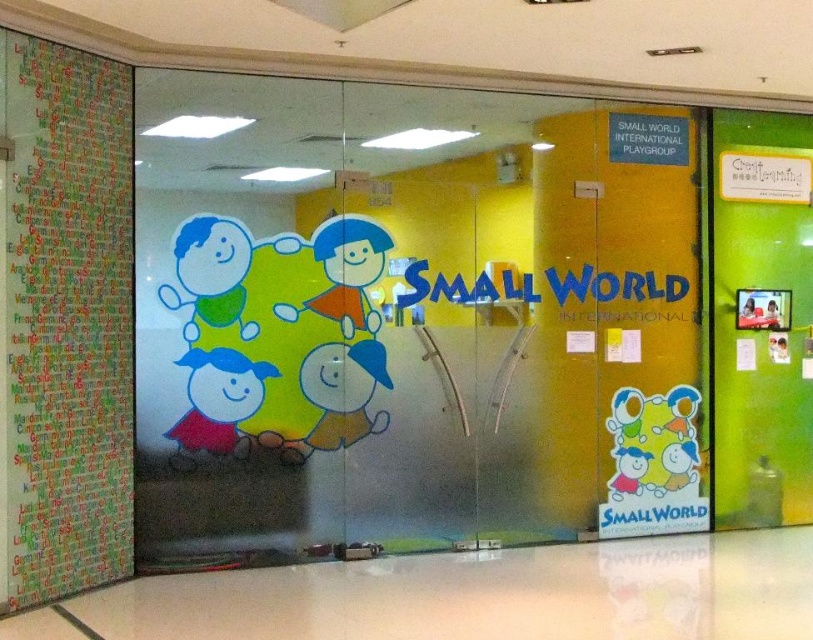
Question: Which is nearer to the matte red dress at lower left?

Choices:
 (A) transparent glass door at center
 (B) multicolored paper at left

Answer: (B)

Question: Which point is closer to the camera?

Choices:
 (A) (24, 198)
 (B) (218, 378)
 (C) (781, 481)
 (D) (342, 330)

Answer: (A)

Question: Does green matte door at right appear over matte red dress at lower left?

Choices:
 (A) no
 (B) yes

Answer: (B)

Question: Can you confirm if green matte door at right is thinner than matte red dress at lower left?

Choices:
 (A) yes
 (B) no

Answer: (B)

Question: In this image, where is transparent glass door at center located relative to multicolored paper at left?

Choices:
 (A) left
 (B) right

Answer: (B)

Question: Which of the following is the closest to the observer?

Choices:
 (A) (241, 396)
 (B) (767, 266)
 (C) (167, 339)
 (D) (112, 339)

Answer: (D)